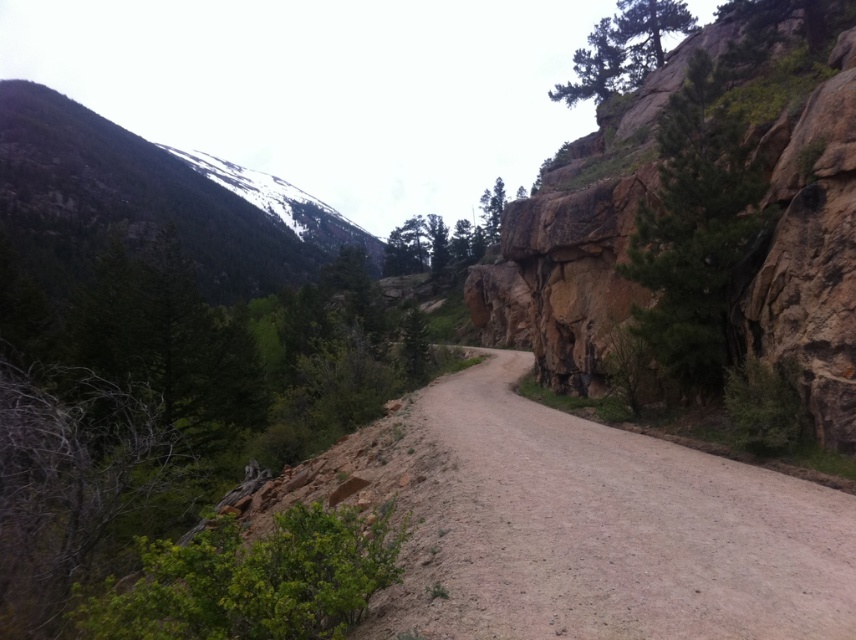
You are driving a large truck with a height of 4 meters. You see the green rough bark tree at upper right and the green matte tree at center in your path. Can you pass through between them without hitting the trees?

The green rough bark tree at upper right is closer to the viewer than the green matte tree at center, so the distance between them is not specified. Without knowing the space between the trees, it is impossible to determine if the truck can pass safely. Please check the actual distance before proceeding.

You are driving a car along the dirt road in the mountainous region. You see two points marked on the road ahead. The first point is at coordinates point (306,545), and the second point is at coordinates point (414,266). Which point is closer to your current position as you drive forward?

Point (306,545) is in front of point (414,266), so the first point is closer to your current position as you drive forward.

You are standing at the starting point of the dirt road in the mountainous landscape. You see a green leafy bush at lower left marked by point (254, 580). If you walk straight along the road, will you pass by this bush on your right or left side?

The green leafy bush at lower left is located to the left side of the road. When walking straight along the road, you would pass by the green leafy bush at lower left on your left side.